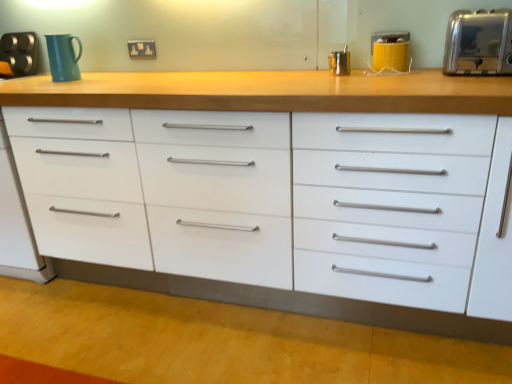
Question: Does matte plastic electric outlet at upper center have a lesser height compared to matte teal mug at upper left?

Choices:
 (A) yes
 (B) no

Answer: (A)

Question: Is matte plastic electric outlet at upper center further to the viewer compared to matte teal mug at upper left?

Choices:
 (A) no
 (B) yes

Answer: (B)

Question: Is matte plastic electric outlet at upper center at the left side of matte teal mug at upper left?

Choices:
 (A) yes
 (B) no

Answer: (B)

Question: Does matte plastic electric outlet at upper center appear on the right side of matte teal mug at upper left?

Choices:
 (A) no
 (B) yes

Answer: (B)

Question: Is matte plastic electric outlet at upper center far from matte teal mug at upper left?

Choices:
 (A) yes
 (B) no

Answer: (B)

Question: Considering the positions of metallic silver container at upper center, which ranks as the 2th appliance in back-to-front order, and satin silver toaster at upper right, the 1th appliance in the front-to-back sequence, in the image, is metallic silver container at upper center, which ranks as the 2th appliance in back-to-front order, taller or shorter than satin silver toaster at upper right, the 1th appliance in the front-to-back sequence,?

Choices:
 (A) short
 (B) tall

Answer: (A)

Question: From the image's perspective, is metallic silver container at upper center, the second appliance when ordered from left to right, positioned above or below satin silver toaster at upper right, the 1th appliance in the front-to-back sequence?

Choices:
 (A) above
 (B) below

Answer: (B)

Question: Is metallic silver container at upper center, the second appliance when ordered from left to right, bigger or smaller than satin silver toaster at upper right, which is the 4th appliance from left to right?

Choices:
 (A) small
 (B) big

Answer: (A)

Question: Is metallic silver container at upper center, which is counted as the 3th appliance, starting from the right, inside or outside of satin silver toaster at upper right, which is the 4th appliance from back to front?

Choices:
 (A) inside
 (B) outside

Answer: (B)

Question: Would you say white glossy chest of drawers at center is inside or outside matte teal mug at upper left?

Choices:
 (A) outside
 (B) inside

Answer: (A)

Question: From the image's perspective, relative to matte teal mug at upper left, is white glossy chest of drawers at center above or below?

Choices:
 (A) below
 (B) above

Answer: (A)

Question: Is point (381, 296) closer or farther from the camera than point (65, 49)?

Choices:
 (A) closer
 (B) farther

Answer: (A)

Question: From a real-world perspective, is white glossy chest of drawers at center physically located above or below matte teal mug at upper left?

Choices:
 (A) above
 (B) below

Answer: (B)

Question: From the image's perspective, is brushed metal toaster at upper left, marked as the 4th appliance in a front-to-back arrangement, located above or below matte teal mug at upper left?

Choices:
 (A) below
 (B) above

Answer: (B)

Question: From a real-world perspective, is brushed metal toaster at upper left, marked as the 4th appliance in a front-to-back arrangement, above or below matte teal mug at upper left?

Choices:
 (A) below
 (B) above

Answer: (A)